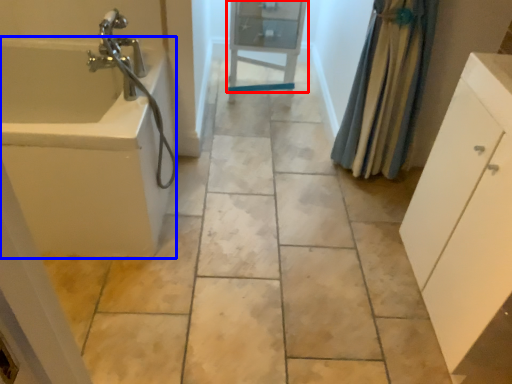
Question: Which object is closer to the camera taking this photo, cabinetry (highlighted by a red box) or bath (highlighted by a blue box)?

Choices:
 (A) cabinetry
 (B) bath

Answer: (B)